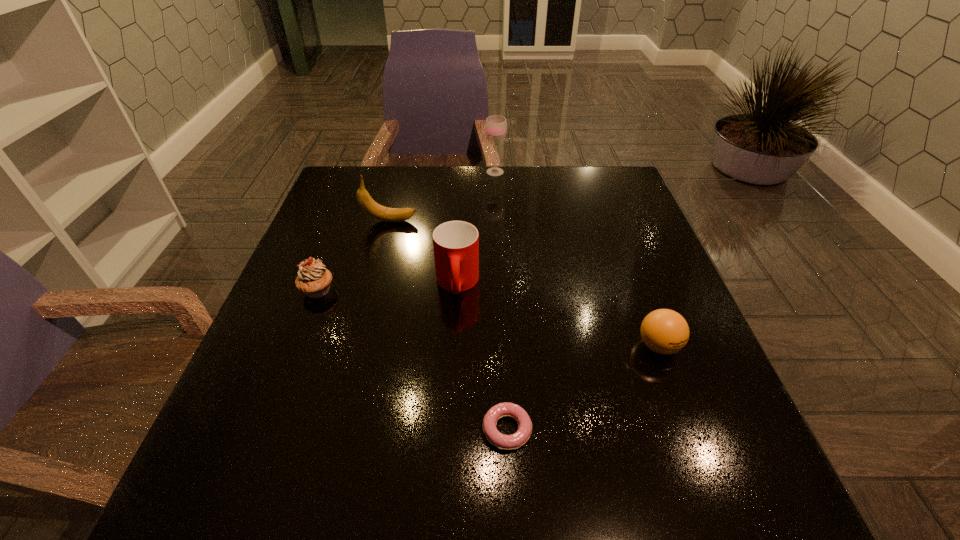
Find the location of a particular element. This screenshot has height=540, width=960. vacant space at the near edge is located at coordinates (322, 502).

In the image, there is a desktop. At what (x,y) coordinates should I click in order to perform the action: click on vacant space at the left edge. Please return your answer as a coordinate pair (x, y). Looking at the image, I should click on (299, 267).

The width and height of the screenshot is (960, 540). What are the coordinates of `free space at the right edge` in the screenshot? It's located at (622, 255).

Locate an element on the screen. This screenshot has width=960, height=540. free space at the far left corner is located at coordinates (356, 205).

Where is `free region at the near left corner`? free region at the near left corner is located at coordinates (186, 502).

Identify the location of vacant space at the far right corner. The width and height of the screenshot is (960, 540). (605, 182).

Find the location of a particular element. This screenshot has height=540, width=960. free area in between the second nearest object and the leftmost object is located at coordinates (488, 318).

Where is `vacant space in between the nearest object and the wineglass`? Image resolution: width=960 pixels, height=540 pixels. vacant space in between the nearest object and the wineglass is located at coordinates (501, 301).

At what (x,y) coordinates should I click in order to perform the action: click on free spot between the farthest object and the fifth farthest object. Please return your answer as a coordinate pair (x, y). Looking at the image, I should click on (577, 259).

At what (x,y) coordinates should I click in order to perform the action: click on vacant region between the farthest object and the cupcake. Please return your answer as a coordinate pair (x, y). The width and height of the screenshot is (960, 540). Looking at the image, I should click on (406, 231).